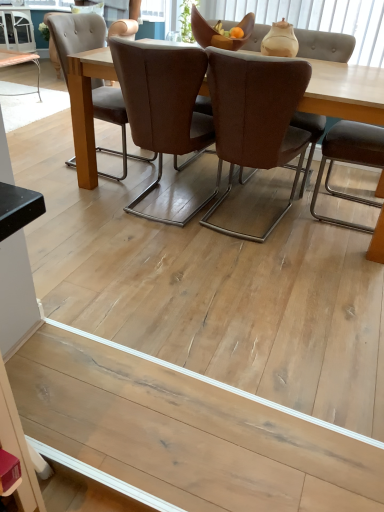
Question: Should I look upward or downward to see white glossy cabinet at upper left?

Choices:
 (A) up
 (B) down

Answer: (A)

Question: From a real-world perspective, is brown fabric chair at center, which appears as the second chair when viewed from the left, beneath matte beige vase at upper center?

Choices:
 (A) yes
 (B) no

Answer: (A)

Question: From the image's perspective, is brown fabric chair at center, which appears as the second chair when viewed from the left, located above matte beige vase at upper center?

Choices:
 (A) yes
 (B) no

Answer: (B)

Question: Is brown fabric chair at center, which ranks as the 2th chair in right-to-left order, aimed at matte beige vase at upper center?

Choices:
 (A) yes
 (B) no

Answer: (A)

Question: From a real-world perspective, is brown fabric chair at center, which ranks as the 2th chair in right-to-left order, physically above matte beige vase at upper center?

Choices:
 (A) yes
 (B) no

Answer: (B)

Question: Is brown fabric chair at center, which ranks as the 2th chair in right-to-left order, outside of matte beige vase at upper center?

Choices:
 (A) no
 (B) yes

Answer: (B)

Question: Does brown fabric chair at center, which appears as the second chair when viewed from the left, have a smaller size compared to matte beige vase at upper center?

Choices:
 (A) no
 (B) yes

Answer: (A)

Question: Can you confirm if matte beige vase at upper center is shorter than brown leather chair at center, which ranks as the first chair in left-to-right order?

Choices:
 (A) yes
 (B) no

Answer: (A)

Question: Does matte beige vase at upper center have a lesser width compared to brown leather chair at center, which ranks as the first chair in left-to-right order?

Choices:
 (A) yes
 (B) no

Answer: (A)

Question: Is matte beige vase at upper center not inside brown leather chair at center, which ranks as the first chair in left-to-right order?

Choices:
 (A) yes
 (B) no

Answer: (A)

Question: Is matte beige vase at upper center turned away from brown leather chair at center, positioned as the 3th chair in right-to-left order?

Choices:
 (A) no
 (B) yes

Answer: (A)

Question: From a real-world perspective, is matte beige vase at upper center positioned under brown leather chair at center, positioned as the 3th chair in right-to-left order, based on gravity?

Choices:
 (A) no
 (B) yes

Answer: (A)

Question: From the image's perspective, is matte beige vase at upper center below brown leather chair at center, which ranks as the first chair in left-to-right order?

Choices:
 (A) yes
 (B) no

Answer: (B)

Question: Is natural wood floor at lower center smaller than white glossy cabinet at upper left?

Choices:
 (A) no
 (B) yes

Answer: (B)